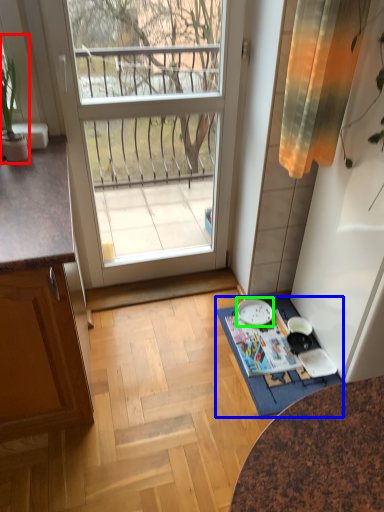
Question: Which is farther away from houseplant (highlighted by a red box)? doormat (highlighted by a blue box) or plate (highlighted by a green box)?

Choices:
 (A) doormat
 (B) plate

Answer: (B)